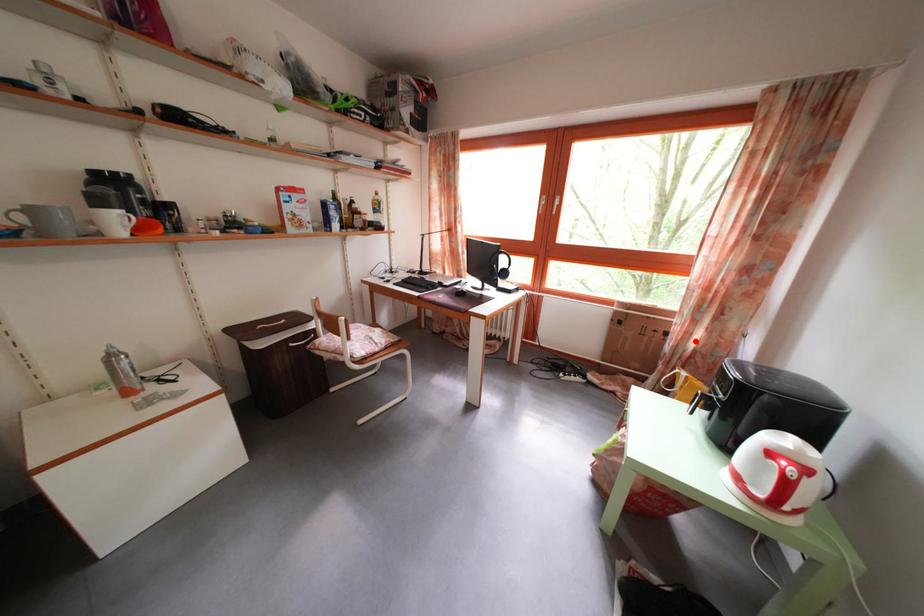
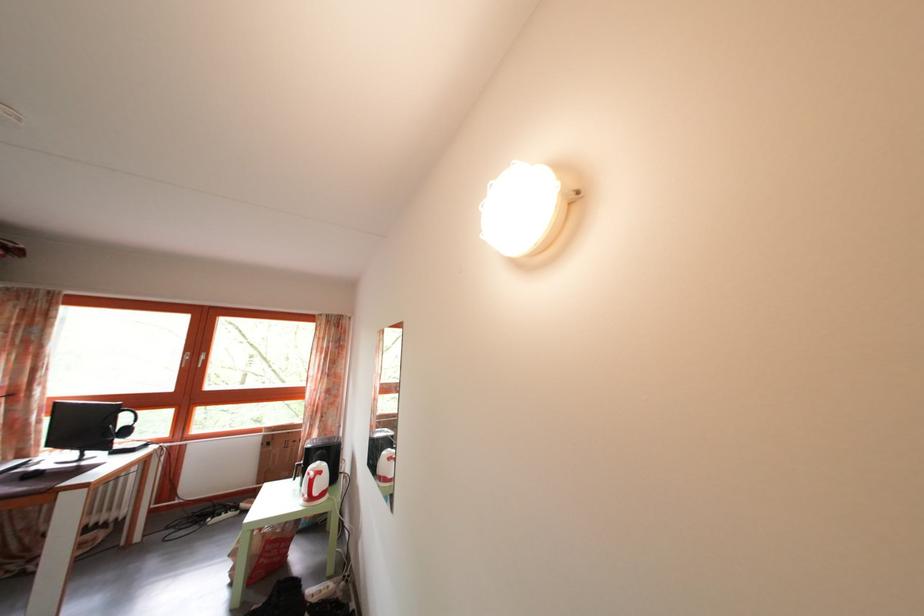
Question: I am providing you with two images of the same scene from different viewpoints. Image1 has a red point marked. In image2, the corresponding 3D location appears at what relative position? Reply with the corresponding letter.

Choices:
 (A) Closer
 (B) Farther

Answer: (B)